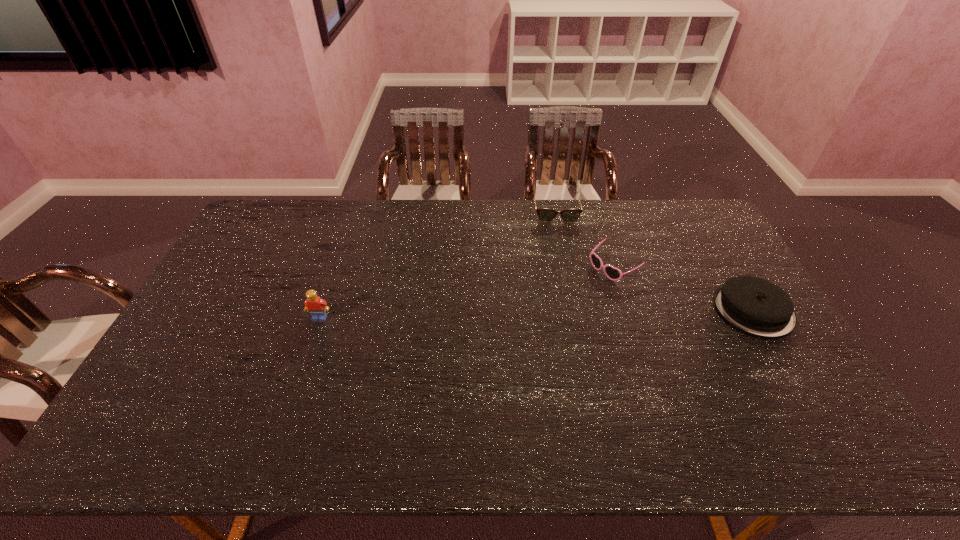
Locate an element on the screen. The height and width of the screenshot is (540, 960). free space between the farthest object and the rightmost object is located at coordinates (655, 260).

Find the location of a particular element. The width and height of the screenshot is (960, 540). object that can be found as the second closest to the Lego is located at coordinates (612, 273).

Choose which object is the second nearest neighbor to the tallest object. Please provide its 2D coordinates. Your answer should be formatted as a tuple, i.e. [(x, y)], where the tuple contains the x and y coordinates of a point satisfying the conditions above.

[(612, 273)]

Where is `free space that satisfies the following two spatial constraints: 1. on the front side of the pancake; 2. on the right side of the sunglasses`? The height and width of the screenshot is (540, 960). free space that satisfies the following two spatial constraints: 1. on the front side of the pancake; 2. on the right side of the sunglasses is located at coordinates (627, 309).

Identify the location of vacant space that satisfies the following two spatial constraints: 1. on the front side of the sunglasses; 2. on the right side of the spectacles. The image size is (960, 540). pyautogui.click(x=567, y=267).

The height and width of the screenshot is (540, 960). I want to click on free space in the image that satisfies the following two spatial constraints: 1. on the front side of the sunglasses; 2. on the right side of the spectacles, so click(x=567, y=267).